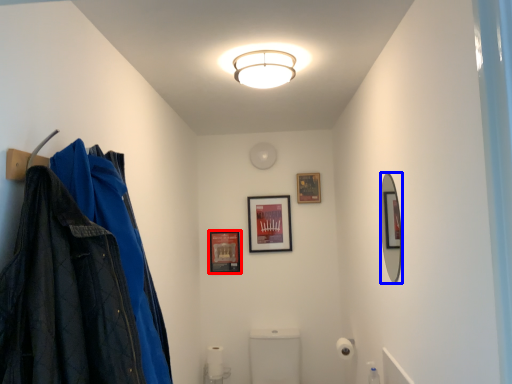
Question: Which object appears farthest to the camera in this image, picture frame (highlighted by a red box) or mirror (highlighted by a blue box)?

Choices:
 (A) picture frame
 (B) mirror

Answer: (A)